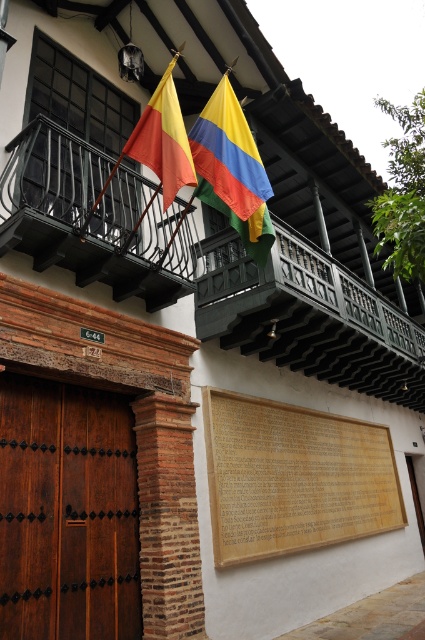
Question: Considering the relative positions of black wrought iron balcony at upper left and yellow-green striped flag at center in the image provided, where is black wrought iron balcony at upper left located with respect to yellow-green striped flag at center?

Choices:
 (A) below
 (B) above

Answer: (A)

Question: Which point is farther to the camera?

Choices:
 (A) (178, 202)
 (B) (265, 179)
 (C) (172, 211)
 (D) (158, 99)

Answer: (C)

Question: Which point is closer to the camera?

Choices:
 (A) (215, 108)
 (B) (136, 140)
 (C) (223, 500)

Answer: (B)

Question: Does black wrought iron balcony at upper center appear under yellow-green striped flag at center?

Choices:
 (A) no
 (B) yes

Answer: (B)

Question: Is yellow-green striped flag at center wider than matte yellow flag at upper center?

Choices:
 (A) no
 (B) yes

Answer: (B)

Question: Among these points, which one is nearest to the camera?

Choices:
 (A) (130, 282)
 (B) (255, 225)

Answer: (A)